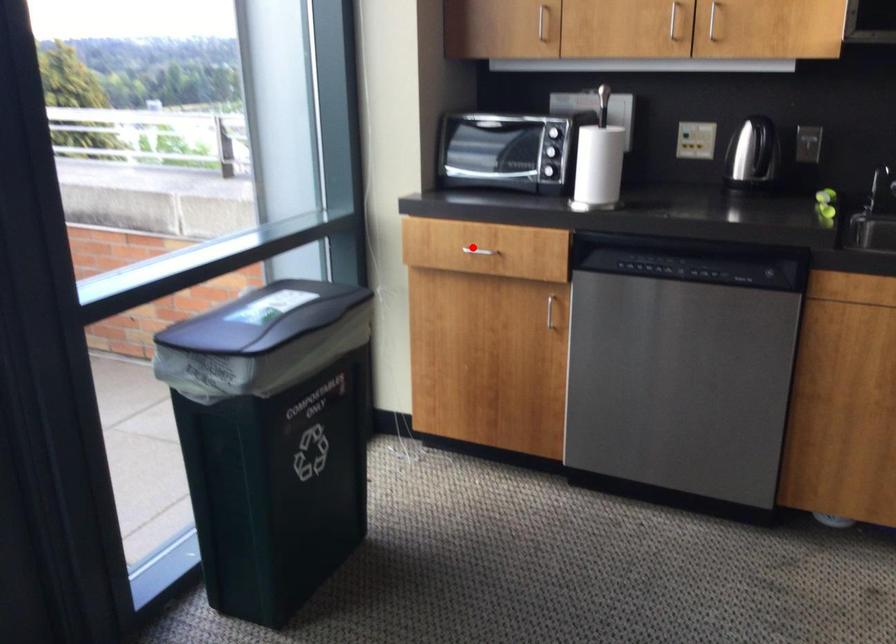
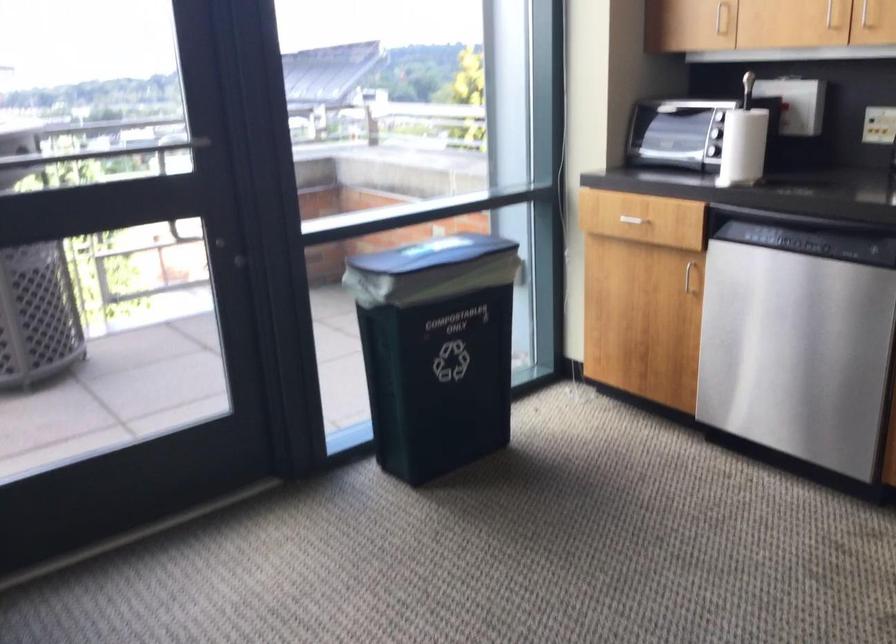
Where in the second image is the point corresponding to the highlighted location from the first image?

(633, 214)